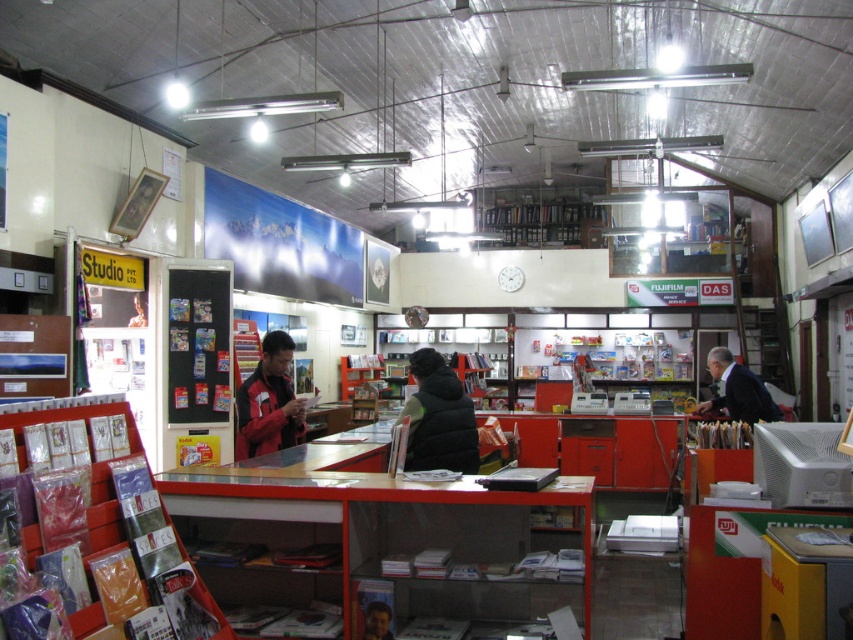
Question: Among these objects, which one is farthest from the camera?

Choices:
 (A) dark suit at right
 (B) red jacket at center
 (C) smooth skin face at center
 (D) black fuzzy jacket at center

Answer: (A)

Question: Can you confirm if red jacket at center is positioned below dark suit at right?

Choices:
 (A) yes
 (B) no

Answer: (B)

Question: Is red jacket at center wider than dark suit at right?

Choices:
 (A) yes
 (B) no

Answer: (B)

Question: Which point appears closest to the camera in this image?

Choices:
 (A) (431, 467)
 (B) (384, 612)
 (C) (746, 372)

Answer: (B)

Question: Observing the image, what is the correct spatial positioning of black fuzzy jacket at center in reference to smooth skin face at center?

Choices:
 (A) right
 (B) left

Answer: (A)

Question: Which of the following is the farthest from the observer?

Choices:
 (A) dark suit at right
 (B) red jacket at center
 (C) smooth skin face at center
 (D) black fuzzy jacket at center

Answer: (A)